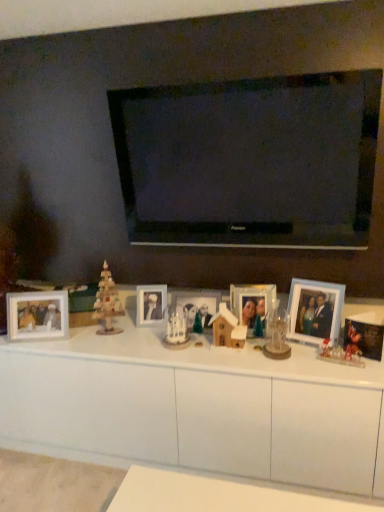
Image resolution: width=384 pixels, height=512 pixels. Find the location of `vacant area that lies in front of translucent plastic gingerbread house at lower right, which appears as the first toy when viewed from the front`. vacant area that lies in front of translucent plastic gingerbread house at lower right, which appears as the first toy when viewed from the front is located at coordinates (348, 374).